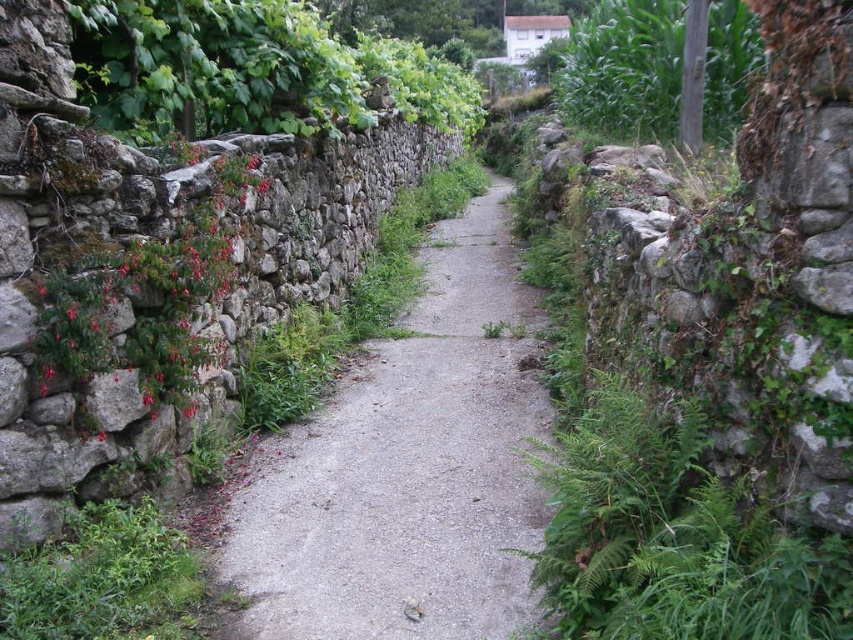
You are a gardener who needs to water both the pink matte flowers at left and the green leafy plant at upper right. Based on their positions, which one is closer to the water source located at the center of the pathway?

The pink matte flowers at left is positioned on the left side of green leafy plant at upper right, so the pink matte flowers at left is closer to the water source located at the center of the pathway.

You are a hiker walking along the narrow pathway between the stone walls. You notice the pink matte flowers at left and the green leafy plant at upper right. Which of these two plants is closer to you?

The pink matte flowers at left are closer to you than the green leafy plant at upper right.

You are standing at the starting point of the pathway and notice a point marked at coordinates [144,298]. According to the scene description, what object is located at that point?

The point at coordinates [144,298] marks pink matte flowers at left.